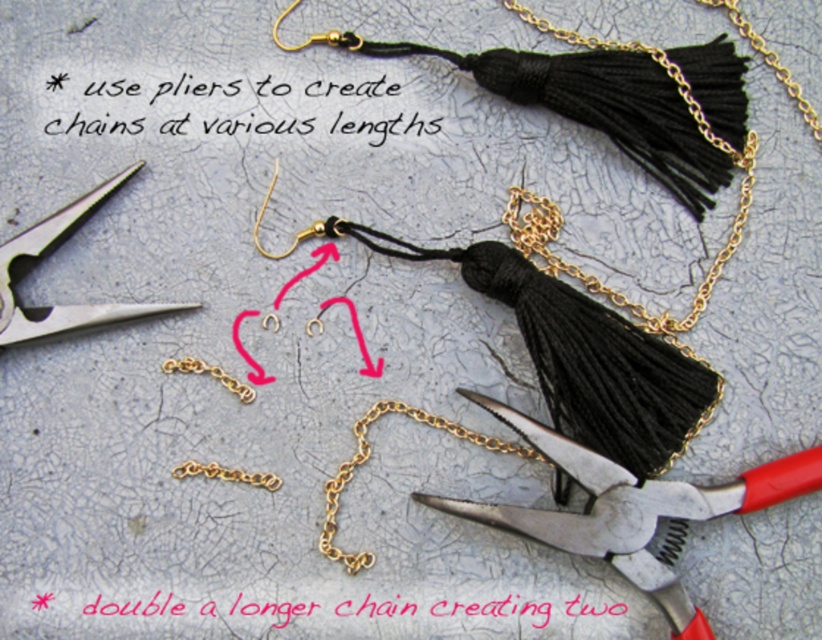
Can you confirm if metallic pliers at lower right is positioned below gold chain at center?

Indeed, metallic pliers at lower right is positioned under gold chain at center.

Is metallic pliers at lower right further to camera compared to gold chain at center?

No.

The image size is (822, 640). Find the location of `metallic pliers at lower right`. metallic pliers at lower right is located at coordinates (631, 509).

The width and height of the screenshot is (822, 640). Identify the location of metallic pliers at lower right. (631, 509).

Can you confirm if black paper at upper center is positioned to the right of pink paper at center?

In fact, black paper at upper center is to the left of pink paper at center.

Can you confirm if black paper at upper center is positioned to the left of pink paper at center?

Yes, black paper at upper center is to the left of pink paper at center.

Who is more forward, (141, 124) or (363, 609)?

Positioned in front is point (363, 609).

Locate an element on the screen. Image resolution: width=822 pixels, height=640 pixels. black paper at upper center is located at coordinates (269, 108).

Can you confirm if pink paper at center is taller than silver metallic scissors at upper left?

In fact, pink paper at center may be shorter than silver metallic scissors at upper left.

Which is below, pink paper at center or silver metallic scissors at upper left?

pink paper at center is below.

Is point (381, 602) positioned in front of point (51, 310)?

That is True.

I want to click on pink paper at center, so click(446, 609).